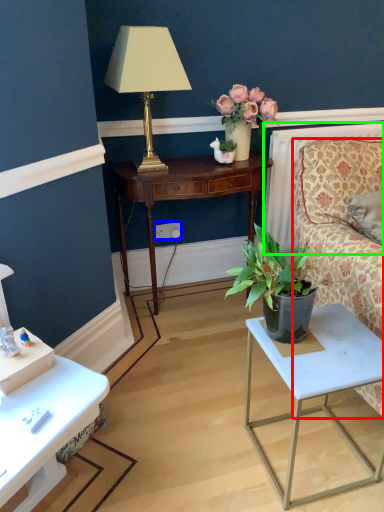
Question: Which is nearer to the studio couch (highlighted by a red box)? power outlet (highlighted by a blue box) or radiator (highlighted by a green box).

Choices:
 (A) power outlet
 (B) radiator

Answer: (B)